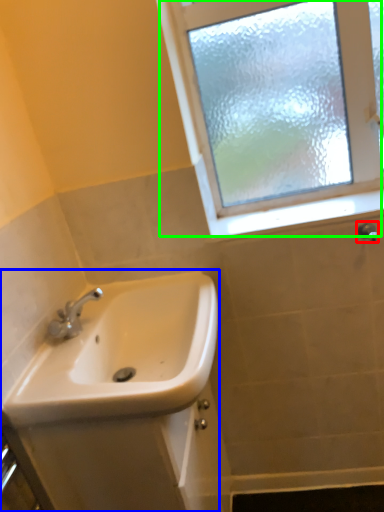
Question: Which is farther away from shower (highlighted by a red box)? sink (highlighted by a blue box) or window (highlighted by a green box)?

Choices:
 (A) sink
 (B) window

Answer: (A)